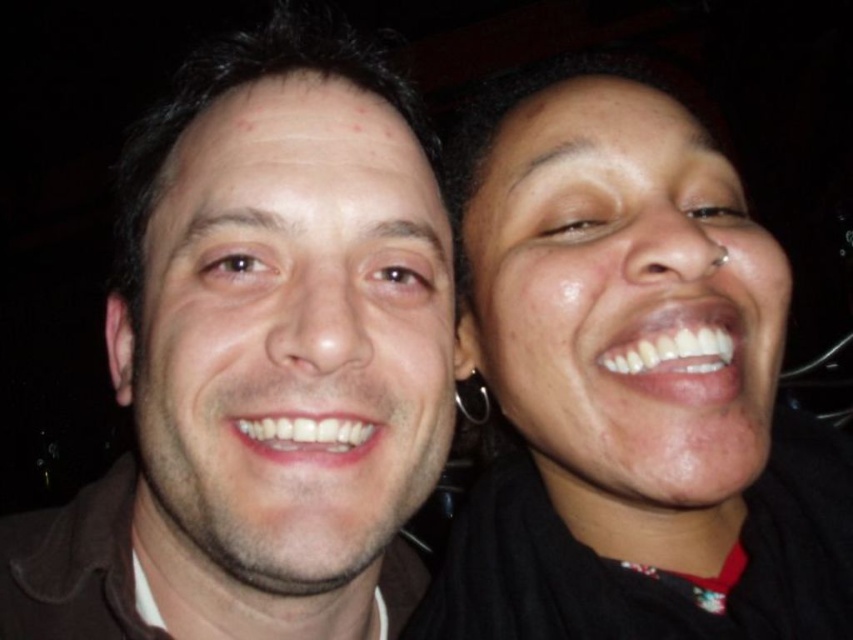
Between point (451, 292) and point (578, 500), which one is positioned behind?

The point (578, 500) is more distant.

Identify the location of matte skin face at left. The image size is (853, 640). (288, 340).

Image resolution: width=853 pixels, height=640 pixels. I want to click on matte skin face at left, so click(288, 340).

Where is `smooth skin face at right`? The height and width of the screenshot is (640, 853). smooth skin face at right is located at coordinates (624, 300).

What do you see at coordinates (624, 300) in the screenshot? This screenshot has height=640, width=853. I see `smooth skin face at right` at bounding box center [624, 300].

The image size is (853, 640). In order to click on smooth skin face at right in this screenshot , I will do `click(624, 300)`.

Who is taller, matte skin face at left or silver metallic hoop earring at upper right?

matte skin face at left

Which is more to the right, matte skin face at left or silver metallic hoop earring at upper right?

silver metallic hoop earring at upper right is more to the right.

What are the coordinates of `matte skin face at left` in the screenshot? It's located at (288, 340).